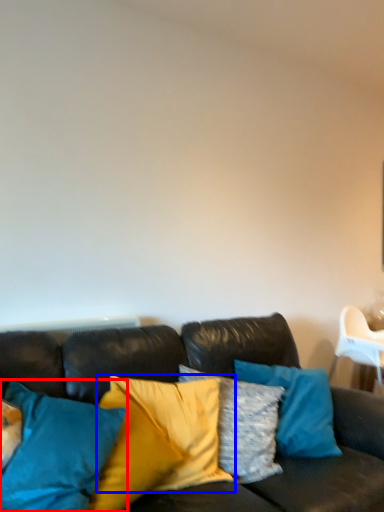
Question: Among these objects, which one is nearest to the camera, pillow (highlighted by a red box) or pillow (highlighted by a blue box)?

Choices:
 (A) pillow
 (B) pillow

Answer: (A)